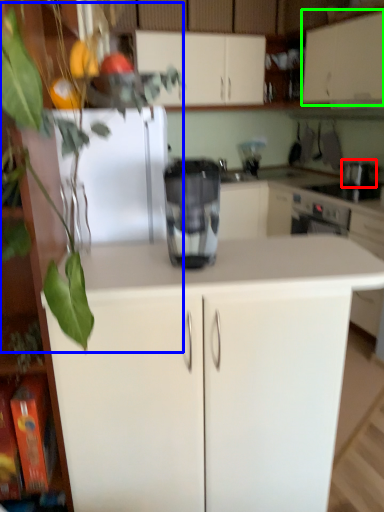
Question: Based on their relative distances, which object is nearer to appliance (highlighted by a red box)? Choose from plant (highlighted by a blue box) and cabinetry (highlighted by a green box).

Choices:
 (A) plant
 (B) cabinetry

Answer: (B)